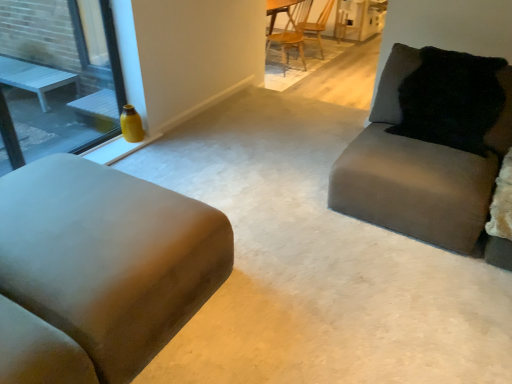
Question: Is black fuzzy pillow at upper right thinner than wooden chair at upper center, marked as the 2th chair in a back-to-front arrangement?

Choices:
 (A) no
 (B) yes

Answer: (B)

Question: Is the depth of black fuzzy pillow at upper right less than that of wooden chair at upper center, marked as the 2th chair in a back-to-front arrangement?

Choices:
 (A) yes
 (B) no

Answer: (A)

Question: Is wooden chair at upper center, the first chair when ordered from front to back, at the back of black fuzzy pillow at upper right?

Choices:
 (A) no
 (B) yes

Answer: (A)

Question: Does black fuzzy pillow at upper right lie behind wooden chair at upper center, marked as the 2th chair in a back-to-front arrangement?

Choices:
 (A) no
 (B) yes

Answer: (A)

Question: Is black fuzzy pillow at upper right outside wooden chair at upper center, the first chair when ordered from front to back?

Choices:
 (A) no
 (B) yes

Answer: (B)

Question: Would you say black fuzzy pillow at upper right contains wooden chair at upper center, marked as the 2th chair in a back-to-front arrangement?

Choices:
 (A) no
 (B) yes

Answer: (A)

Question: From a real-world perspective, does black fuzzy pillow at upper right stand above matte yellow vase at left?

Choices:
 (A) yes
 (B) no

Answer: (B)

Question: Would you say black fuzzy pillow at upper right contains matte yellow vase at left?

Choices:
 (A) no
 (B) yes

Answer: (A)

Question: Is black fuzzy pillow at upper right to the left of matte yellow vase at left from the viewer's perspective?

Choices:
 (A) yes
 (B) no

Answer: (B)

Question: Does black fuzzy pillow at upper right come in front of matte yellow vase at left?

Choices:
 (A) no
 (B) yes

Answer: (A)

Question: Can you confirm if black fuzzy pillow at upper right is positioned to the right of matte yellow vase at left?

Choices:
 (A) no
 (B) yes

Answer: (B)

Question: Is black fuzzy pillow at upper right facing towards matte yellow vase at left?

Choices:
 (A) yes
 (B) no

Answer: (B)

Question: From the image's perspective, is suede-like beige couch at left, the 2th studio couch positioned from the right, under black fuzzy pillow at upper right?

Choices:
 (A) yes
 (B) no

Answer: (A)